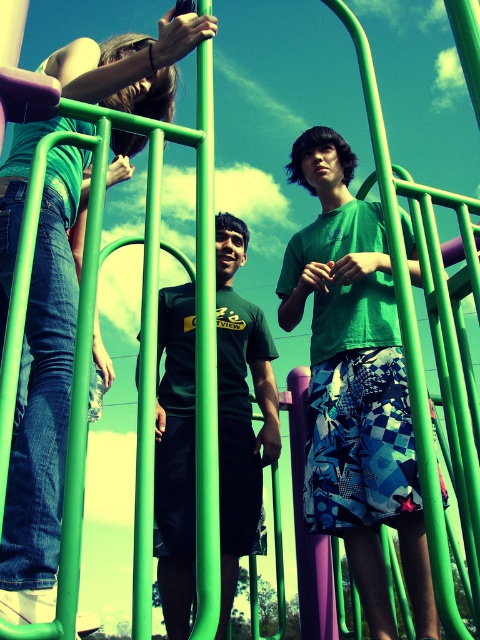
Between point (397, 465) and point (60, 428), which one is positioned behind?

The point (397, 465) is more distant.

Does green matte shirt at center appear on the left side of green matte shirt at upper center?

No, green matte shirt at center is not to the left of green matte shirt at upper center.

Is point (337, 486) closer to camera compared to point (122, 97)?

No, it is not.

In order to click on green matte shirt at center in this screenshot , I will do `click(355, 385)`.

Can you confirm if green matte shirt at upper center is taller than black matte t-shirt at center?

In fact, green matte shirt at upper center may be shorter than black matte t-shirt at center.

Between green matte shirt at upper center and black matte t-shirt at center, which one appears on the left side from the viewer's perspective?

green matte shirt at upper center

Is point (66, 195) more distant than point (225, 323)?

No, (66, 195) is closer to viewer.

This screenshot has height=640, width=480. What are the coordinates of `green matte shirt at upper center` in the screenshot? It's located at (43, 403).

Who is more distant from viewer, (365, 589) or (180, 598)?

The point (180, 598) is more distant.

Between point (396, 525) and point (156, 529), which one is positioned in front?

Point (396, 525) is more forward.

Between point (350, 536) and point (229, 524), which one is positioned in front?

Point (350, 536) is more forward.

Where is `green matte shirt at center`? green matte shirt at center is located at coordinates (355, 385).